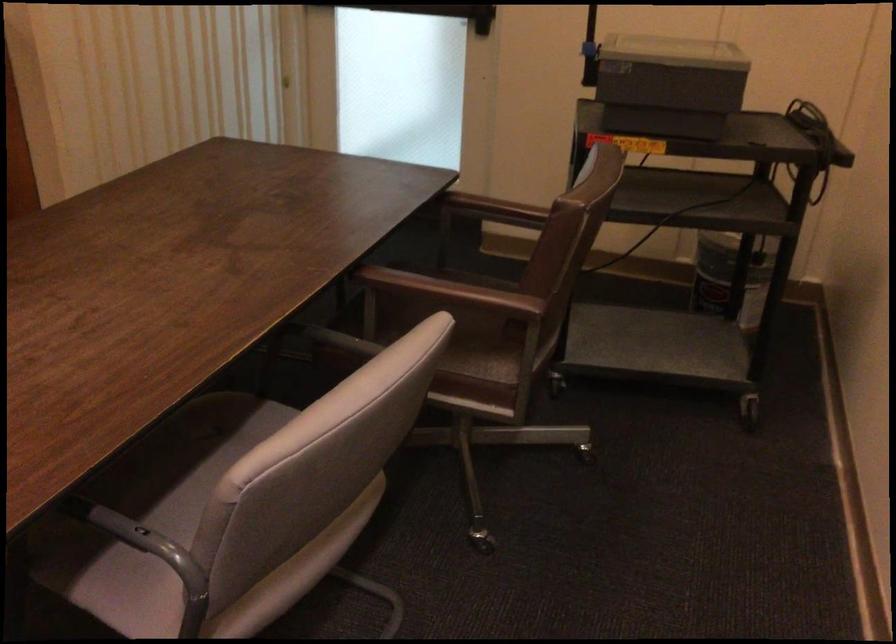
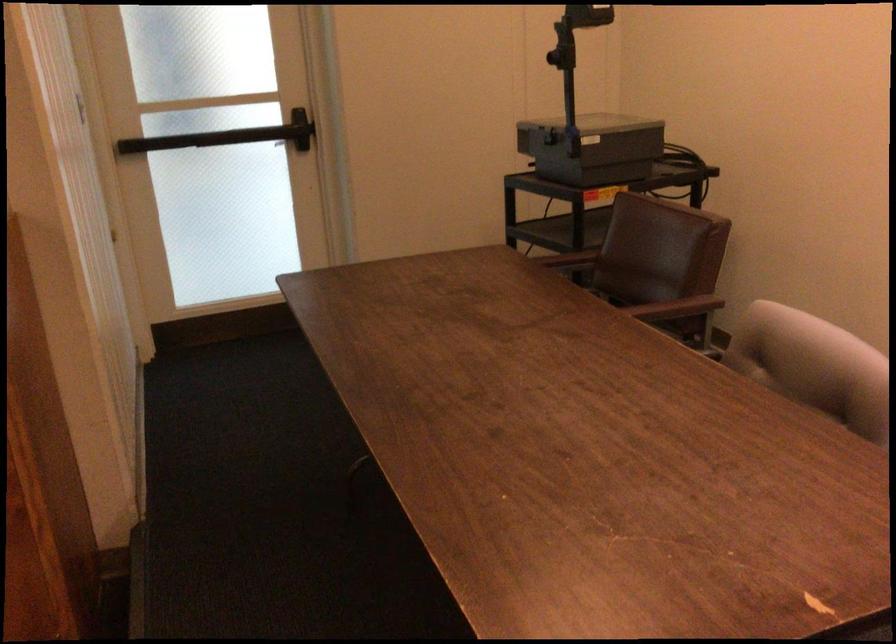
Question: I am providing you with two images of the same scene from different viewpoints. Please identify which objects are invisible in image2.

Choices:
 (A) brown chair sitting surface
 (B) overhead projector
 (C) cardboard tube roll
 (D) black door push bar

Answer: (A)